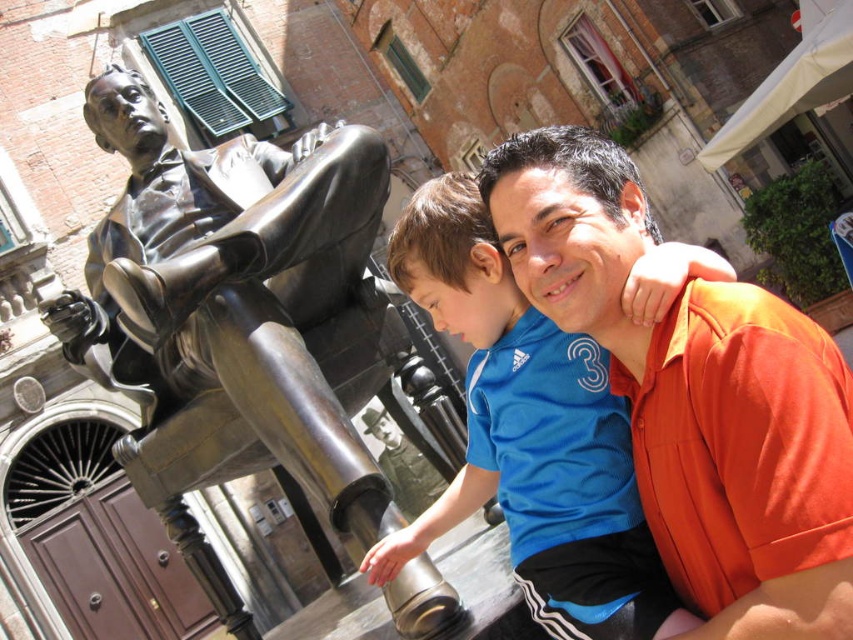
Does bronze statue at left lie behind blue jersey at center?

Yes, bronze statue at left is further from the viewer.

This screenshot has height=640, width=853. I want to click on bronze statue at left, so click(236, 310).

Is orange cotton shirt at upper right positioned before blue jersey at center?

Yes, orange cotton shirt at upper right is in front of blue jersey at center.

Does orange cotton shirt at upper right have a lesser height compared to blue jersey at center?

In fact, orange cotton shirt at upper right may be taller than blue jersey at center.

Where is `orange cotton shirt at upper right`? Image resolution: width=853 pixels, height=640 pixels. orange cotton shirt at upper right is located at coordinates (695, 396).

Is bronze statue at left shorter than orange cotton shirt at upper right?

In fact, bronze statue at left may be taller than orange cotton shirt at upper right.

Measure the distance from bronze statue at left to orange cotton shirt at upper right.

bronze statue at left and orange cotton shirt at upper right are 7.72 meters apart from each other.

Which is behind, point (410, 602) or point (585, 248)?

Positioned behind is point (585, 248).

Identify the location of bronze statue at left. (236, 310).